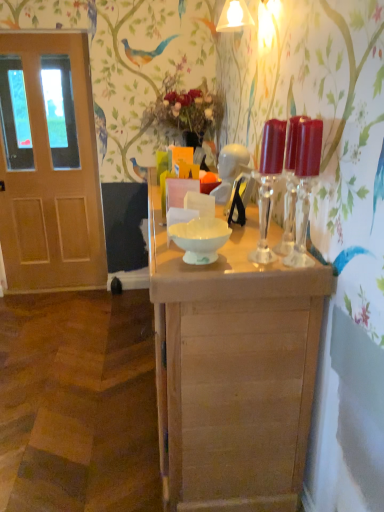
Question: Considering the positions of point (190, 324) and point (173, 240), is point (190, 324) closer or farther from the camera than point (173, 240)?

Choices:
 (A) farther
 (B) closer

Answer: (B)

Question: From the image's perspective, is light brown wooden table at center positioned above or below white glossy bowl at center?

Choices:
 (A) above
 (B) below

Answer: (B)

Question: Which of these objects is positioned closest to the white glossy bowl at center?

Choices:
 (A) translucent glass candle holders at right, which is counted as the 2th candle holder, starting from the left
 (B) transparent glass candle holders at center, placed as the 2th candle holder when sorted from right to left
 (C) light brown wooden table at center
 (D) wooden door at left

Answer: (B)

Question: Which object is positioned farthest from the white glossy bowl at center?

Choices:
 (A) wooden door at left
 (B) translucent glass candle holders at right, which is counted as the 2th candle holder, starting from the left
 (C) transparent glass candle holders at center, placed as the 2th candle holder when sorted from right to left
 (D) light brown wooden table at center

Answer: (A)